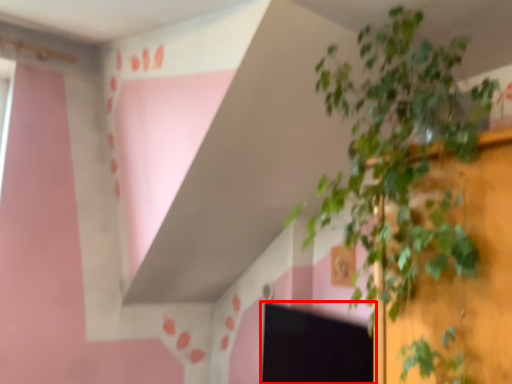
Question: From the image's perspective, considering the relative positions of computer screen (annotated by the red box) and houseplant in the image provided, where is computer screen (annotated by the red box) located with respect to the staircase?

Choices:
 (A) above
 (B) below

Answer: (B)